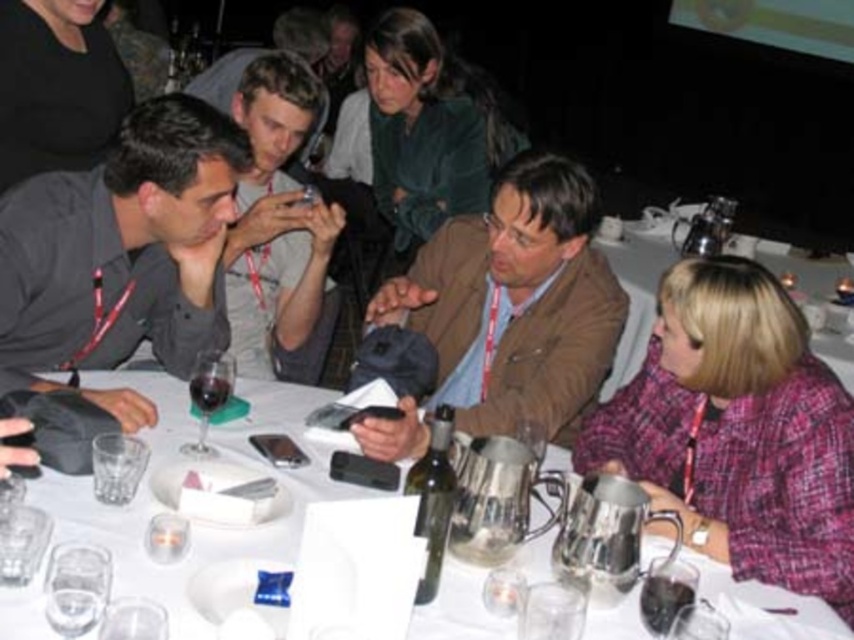
Question: Does pink tweed jacket at lower right have a larger size compared to brown leather jacket at center?

Choices:
 (A) no
 (B) yes

Answer: (A)

Question: Can you confirm if metallic silver wine at center is smaller than translucent glass wine glass at lower left?

Choices:
 (A) yes
 (B) no

Answer: (B)

Question: Considering the real-world distances, which object is closest to the pink tweed jacket at lower right?

Choices:
 (A) translucent glass wine glass at lower left
 (B) brown leather jacket at center
 (C) matte black shirt at left

Answer: (B)

Question: Is pink tweed jacket at lower right in front of transparent glass at lower left?

Choices:
 (A) yes
 (B) no

Answer: (B)

Question: Which point is farther from the camera taking this photo?

Choices:
 (A) (130, 422)
 (B) (583, 470)

Answer: (B)

Question: Among these points, which one is farthest from the camera?

Choices:
 (A) (106, 550)
 (B) (50, 240)
 (C) (819, 468)

Answer: (B)